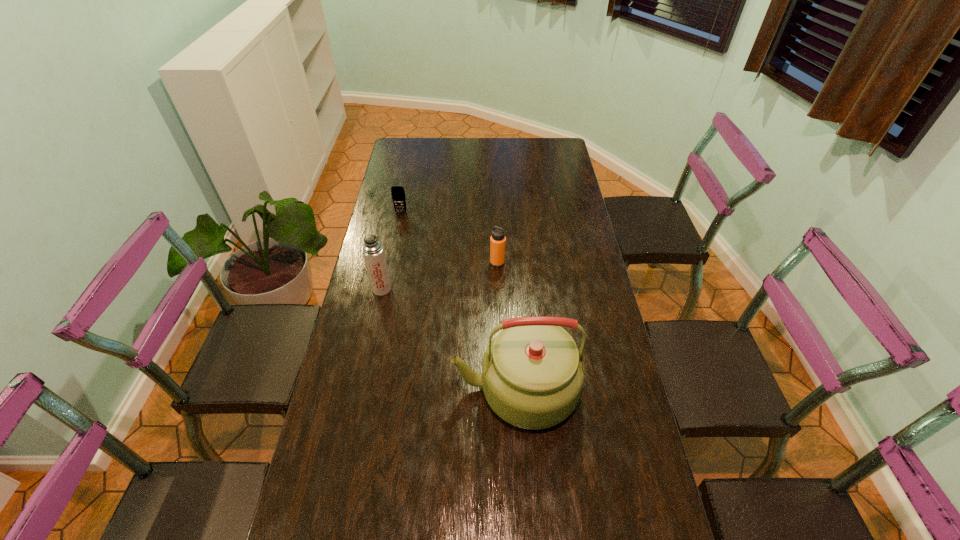
Where is `free space between the farthest object and the tallest object`? This screenshot has width=960, height=540. free space between the farthest object and the tallest object is located at coordinates (458, 300).

Image resolution: width=960 pixels, height=540 pixels. I want to click on vacant area that lies between the cellular telephone and the farther thermos bottle, so click(x=449, y=237).

Image resolution: width=960 pixels, height=540 pixels. Find the location of `unoccupied area between the tallest object and the nearer thermos bottle`. unoccupied area between the tallest object and the nearer thermos bottle is located at coordinates (448, 339).

The height and width of the screenshot is (540, 960). I want to click on empty space between the left thermos bottle and the farthest object, so click(392, 250).

I want to click on free space between the farthest object and the nearest object, so click(x=458, y=300).

You are a GUI agent. You are given a task and a screenshot of the screen. Output one action in this format:
    pyautogui.click(x=<x>, y=<y>)
    Task: Click on the vacant point located between the right thermos bottle and the shortest object
    
    Given the screenshot: What is the action you would take?
    pyautogui.click(x=449, y=237)

I want to click on object that stands as the third closest to the cellular telephone, so click(532, 375).

Image resolution: width=960 pixels, height=540 pixels. Find the location of `object that is the closest to the farthest object`. object that is the closest to the farthest object is located at coordinates (373, 252).

I want to click on free space that satisfies the following two spatial constraints: 1. on the screen of the farther thermos bottle; 2. on the right side of the cellular telephone, so click(391, 262).